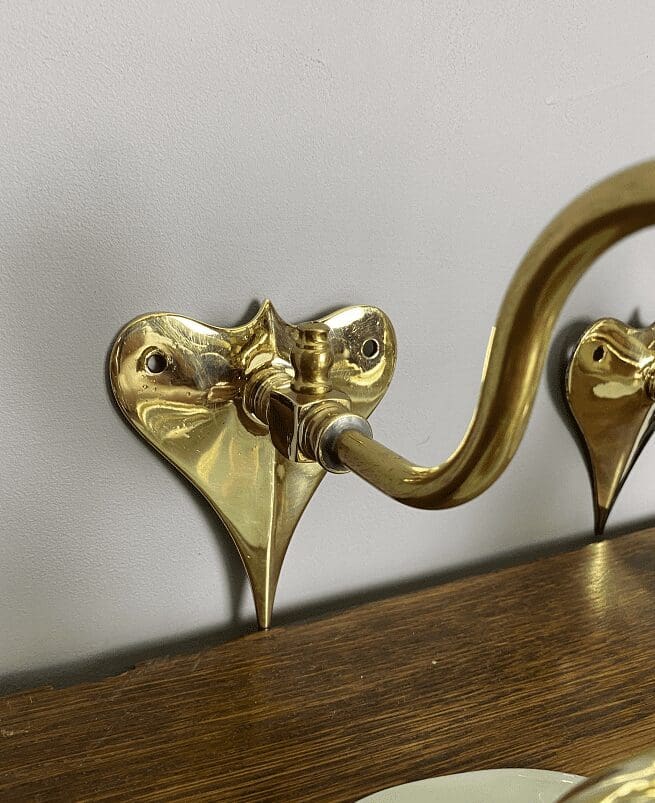
What are the coordinates of `table` in the screenshot? It's located at (483, 740).